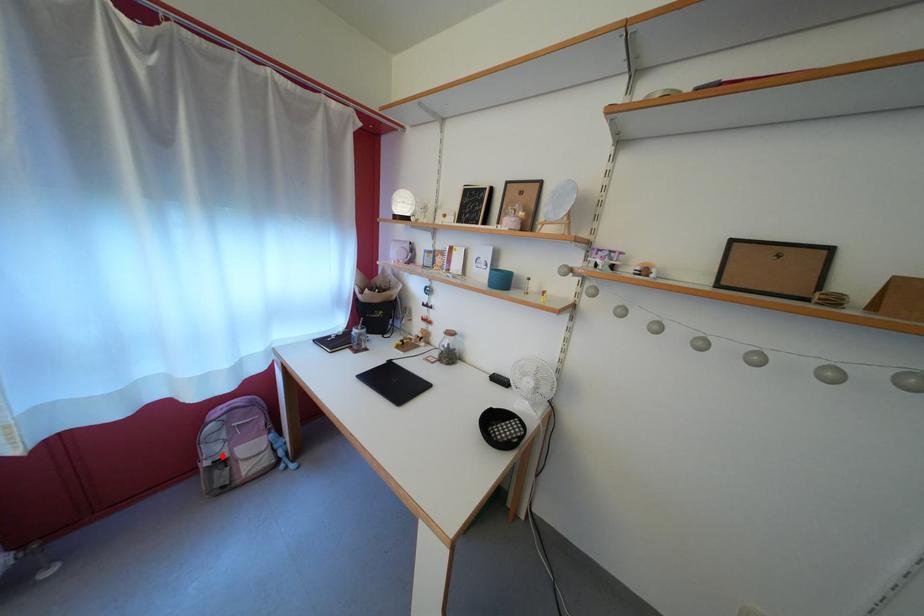
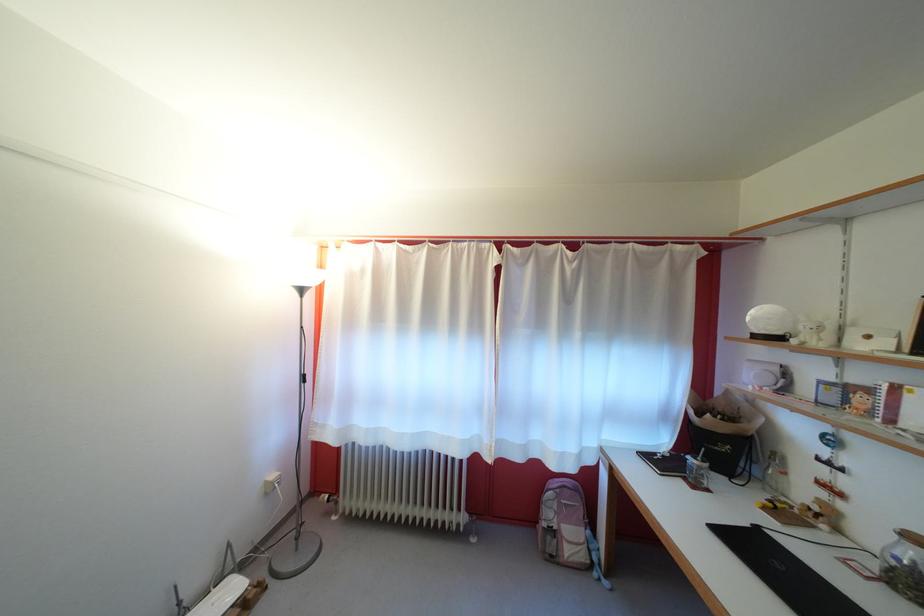
The point at the highlighted location is marked in the first image. Where is the corresponding point in the second image?

(556, 521)